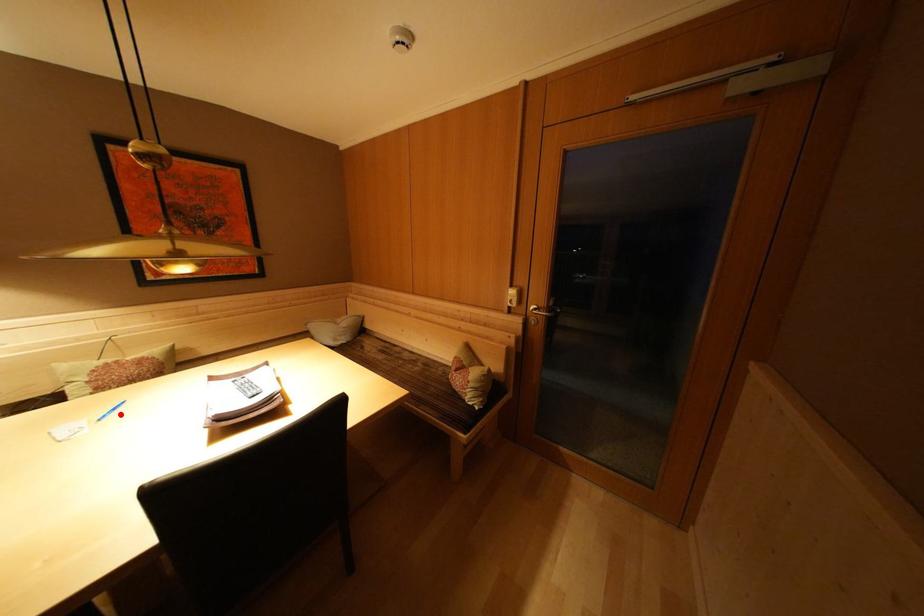
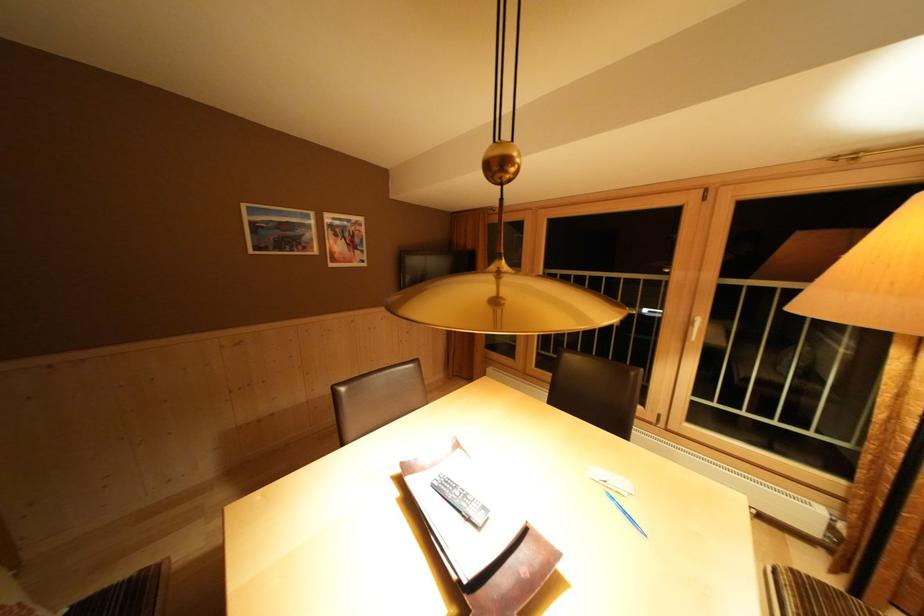
The point at the highlighted location is marked in the first image. Where is the corresponding point in the second image?

(633, 517)